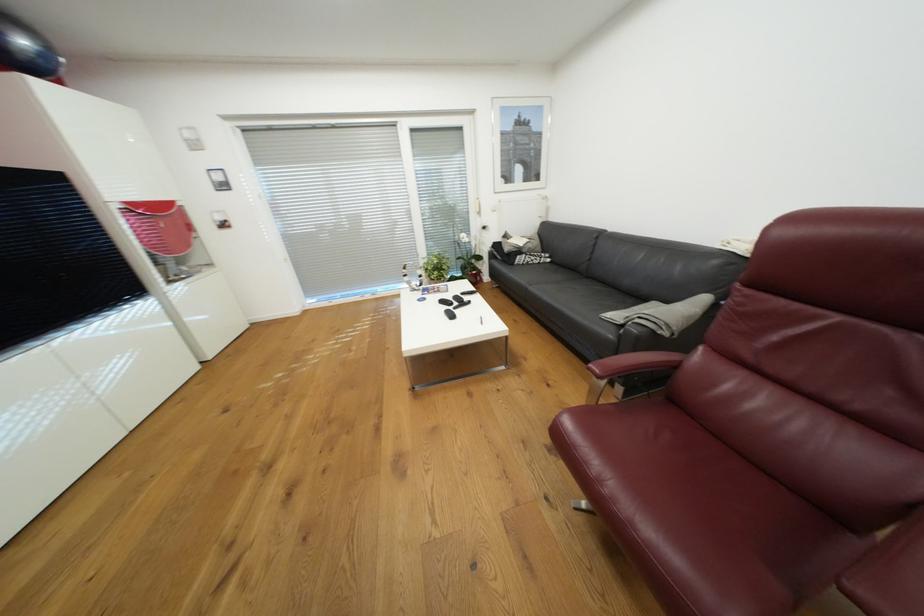
The width and height of the screenshot is (924, 616). I want to click on white door handle, so click(477, 206).